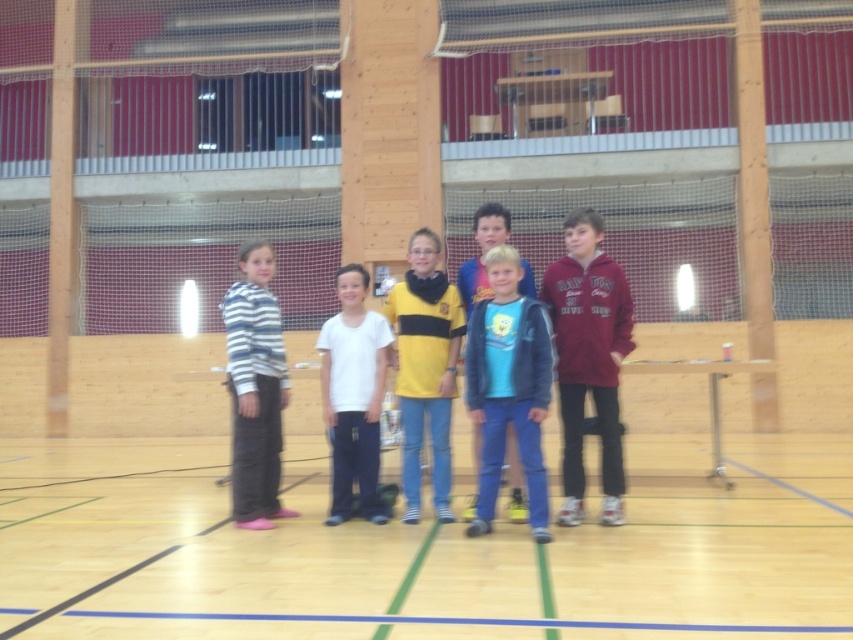
You are a photographer setting up for a group photo in the sports hall. You need to position the wooden floor at center and the maroon fleece jacket at center in your shot. Which object should be placed to the left side of your camera frame?

The wooden floor at center should be placed to the left side of your camera frame because it is located to the left of the maroon fleece jacket at center according to the description.

You are a photographer positioned at the front of the sports hall. You need to take a photo that includes both the maroon fleece jacket at center and the striped hoodie at left. Which child should you adjust their position so that both are clearly visible in the frame?

The striped hoodie at left is farther from the viewer than the maroon fleece jacket at center. To ensure both are visible, move the striped hoodie at left forward closer to the photographer so it aligns with the maroon fleece jacket at center in the frame.